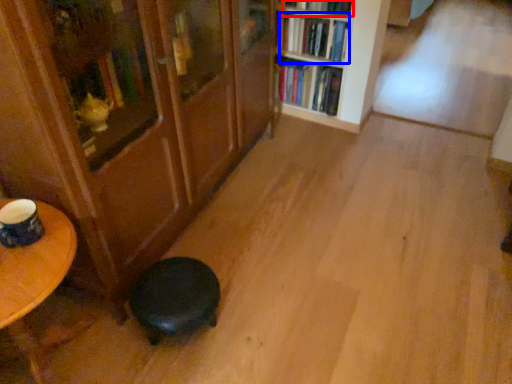
Question: Which point is closer to the camera, book (highlighted by a red box) or book (highlighted by a blue box)?

Choices:
 (A) book
 (B) book

Answer: (A)